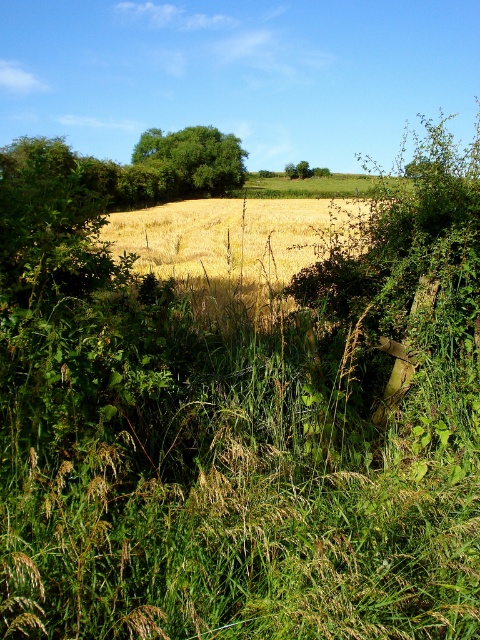
Who is more distant from viewer, (267, 212) or (210, 188)?

Point (210, 188)

Image resolution: width=480 pixels, height=640 pixels. Find the location of `golden dry grass at center`. golden dry grass at center is located at coordinates (233, 236).